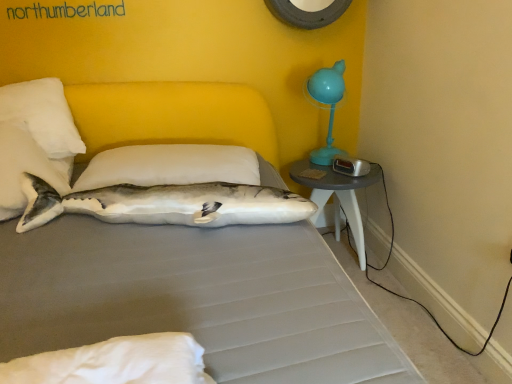
Question: Is white soft pillow at center, arranged as the 2th pillow when viewed from the left, situated inside gray plastic nightstand at right or outside?

Choices:
 (A) inside
 (B) outside

Answer: (B)

Question: Considering the positions of white soft pillow at center, which is the first pillow from right to left, and gray plastic nightstand at right in the image, is white soft pillow at center, which is the first pillow from right to left, wider or thinner than gray plastic nightstand at right?

Choices:
 (A) wide
 (B) thin

Answer: (A)

Question: Which is farther from the gray plastic nightstand at right?

Choices:
 (A) white fabric shark at center
 (B) white plush shark at upper left, the 1th pillow from the left
 (C) white soft pillow at center, arranged as the 2th pillow when viewed from the left

Answer: (B)

Question: Which object is positioned farthest from the white soft pillow at center, which is the first pillow from right to left?

Choices:
 (A) white plush shark at upper left, the second pillow in the right-to-left sequence
 (B) white fabric shark at center
 (C) gray plastic nightstand at right

Answer: (C)